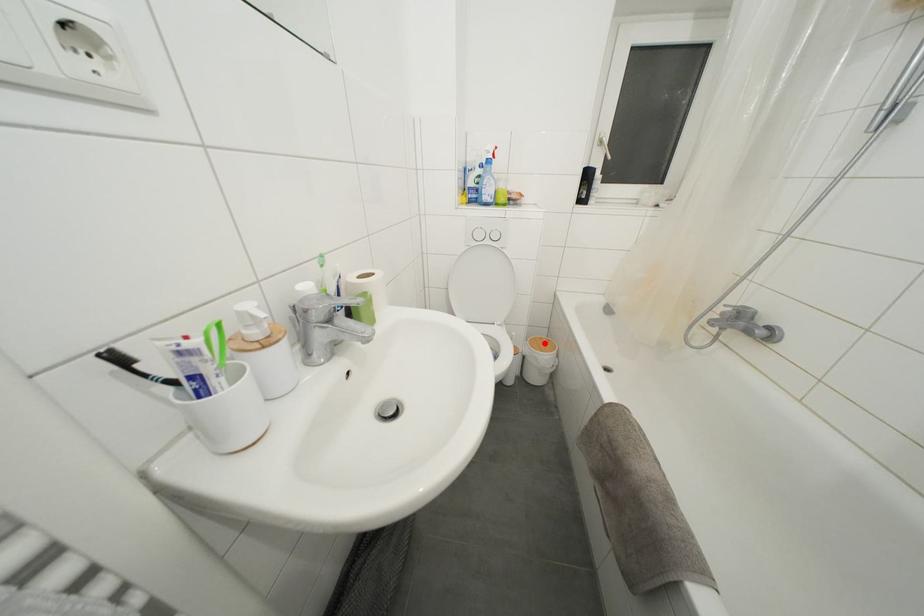
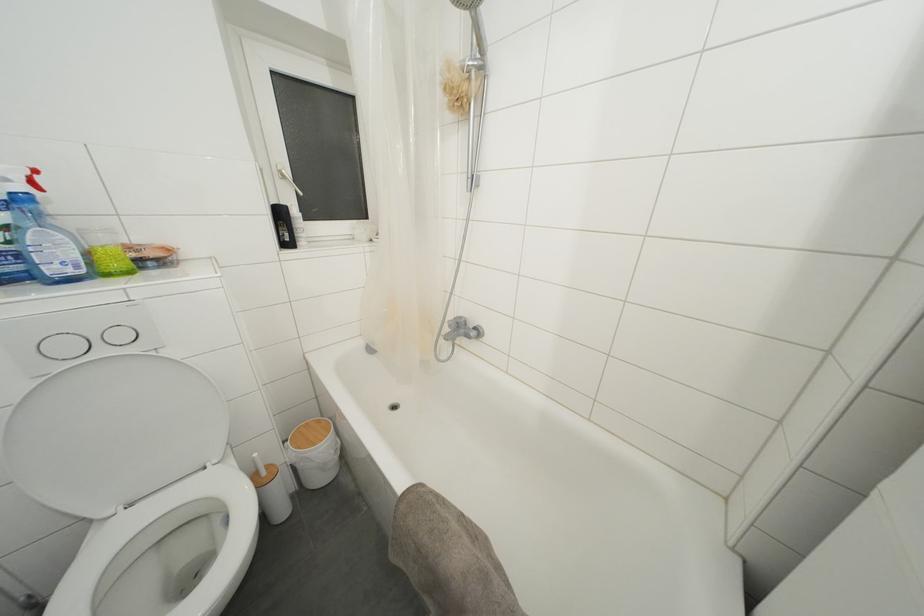
Question: I am providing you with two images of the same scene from different viewpoints. A red point is shown in image1. For the corresponding object point in image2, is it positioned nearer or farther from the camera?

Choices:
 (A) Nearer
 (B) Farther

Answer: (B)